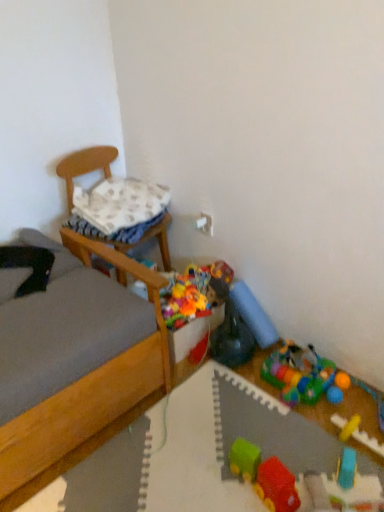
Question: From the image's perspective, is rubberized plastic play mat at lower right, placed as the 4th toy when sorted from front to back, above or below rubberized plastic train at center, positioned as the 6th toy in back-to-front order?

Choices:
 (A) above
 (B) below

Answer: (A)

Question: Is point (309, 391) positioned closer to the camera than point (274, 490)?

Choices:
 (A) farther
 (B) closer

Answer: (A)

Question: Which object is positioned closest to the rubberized plastic train at center, the 1th toy in the front-to-back sequence?

Choices:
 (A) rubber duck at center, which is counted as the fifth toy, starting from the front
 (B) rubberized plastic play mat at lower right, placed as the 4th toy when sorted from front to back
 (C) wooden chair at left
 (D) yellow rubber train at lower right, placed as the fifth toy when sorted from back to front
 (E) wooden bed at left

Answer: (D)

Question: Estimate the real-world distances between objects in this image. Which object is farther from the wooden bed at left?

Choices:
 (A) rubberized plastic play mat at lower right, the third toy viewed from the back
 (B) yellow rubber train at lower right, which is the 2th toy from front to back
 (C) blue rubber toy at lower right, which is the fourth toy in back-to-front order
 (D) rubberized plastic train at center, the 1th toy in the front-to-back sequence
 (E) wooden chair at left

Answer: (B)